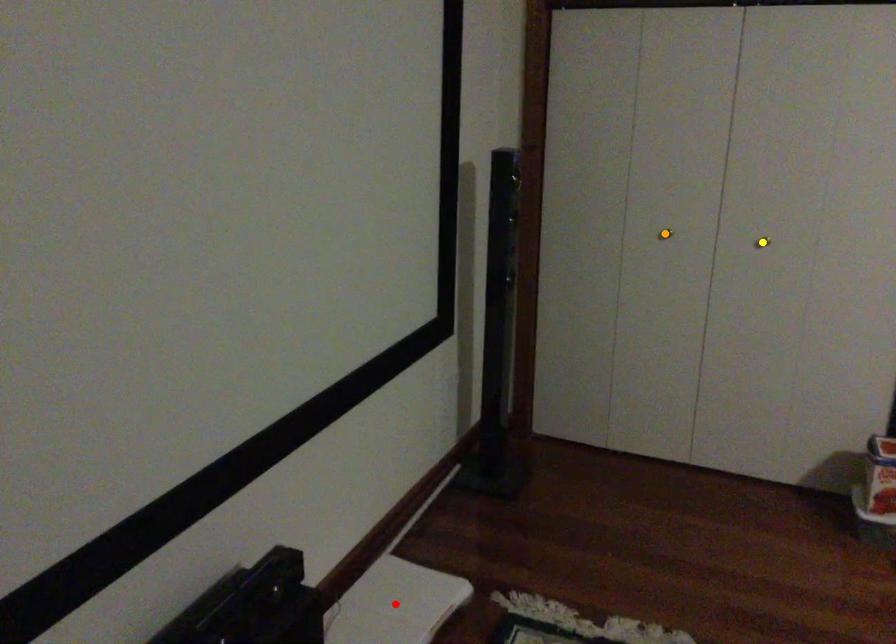
Order these from nearest to farthest:
orange point | red point | yellow point

orange point → yellow point → red point